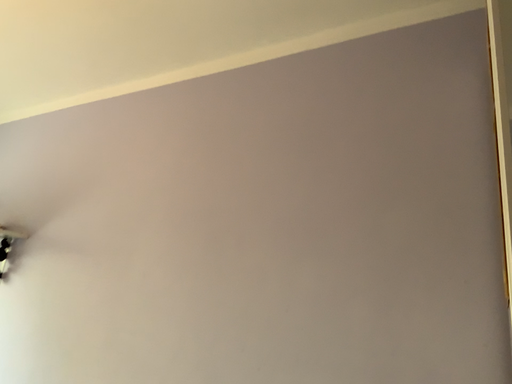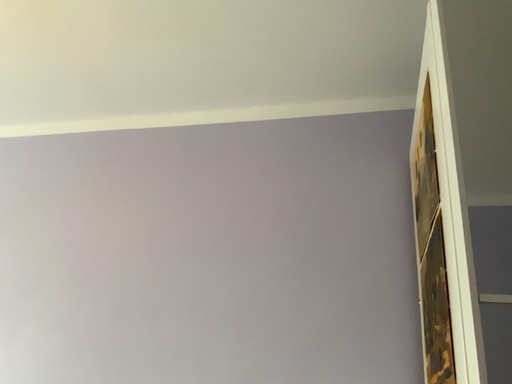
Question: Which way did the camera rotate in the video?

Choices:
 (A) rotated downward
 (B) rotated upward

Answer: (B)